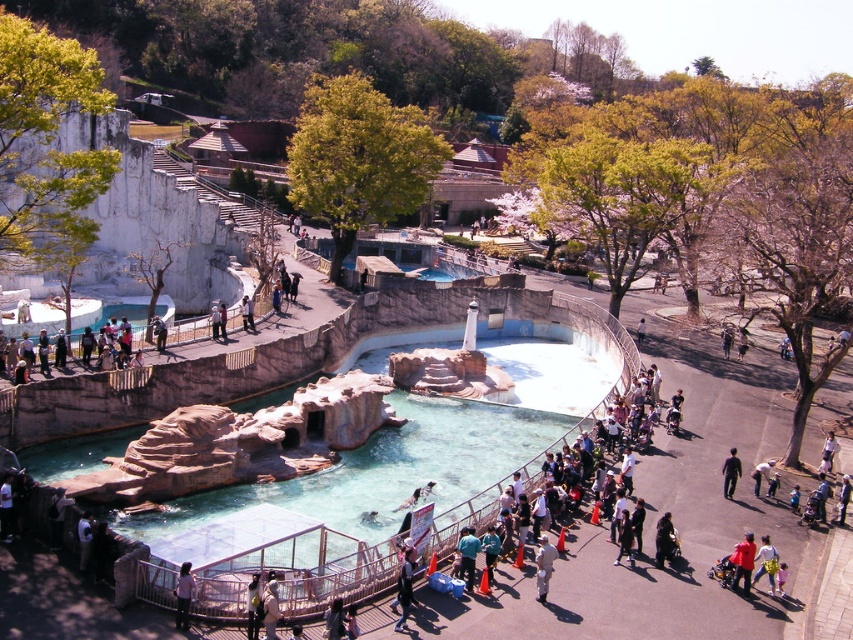
You are a zookeeper preparing to feed the animals. You see the clear glass pool at center and the white cotton shirt at center. Which object is located to the left of the other?

The clear glass pool at center is positioned on the left side of white cotton shirt at center.

You are a zookeeper who needs to locate the light blue denim jacket at lower right. According to the coordinates provided, where exactly is it positioned in the image?

The light blue denim jacket at lower right is located at point (766, 563) in the image.

You are a photographer standing in the zoo area and want to capture both the white cotton shirt at center and the black matte pants at lower right in your photo. Which object will appear larger in the photo?

The white cotton shirt at center will appear larger in the photo because it is taller than the black matte pants at lower right.